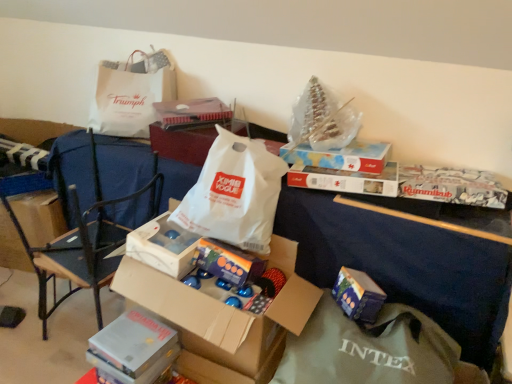
The image size is (512, 384). I want to click on free spot in front of shiny metallic box at center, which is counted as the second gift, starting from the right, so (223, 295).